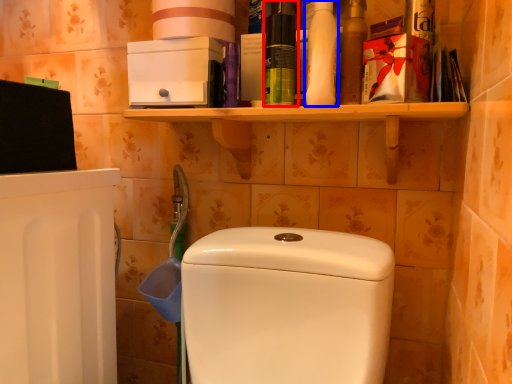
Question: Which of the following is the farthest to the observer, cleaning product (highlighted by a red box) or cleaning product (highlighted by a blue box)?

Choices:
 (A) cleaning product
 (B) cleaning product

Answer: (A)